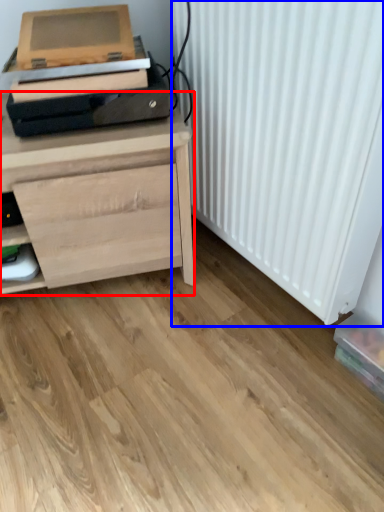
Question: Among these objects, which one is farthest to the camera, chest of drawers (highlighted by a red box) or radiator (highlighted by a blue box)?

Choices:
 (A) chest of drawers
 (B) radiator

Answer: (A)